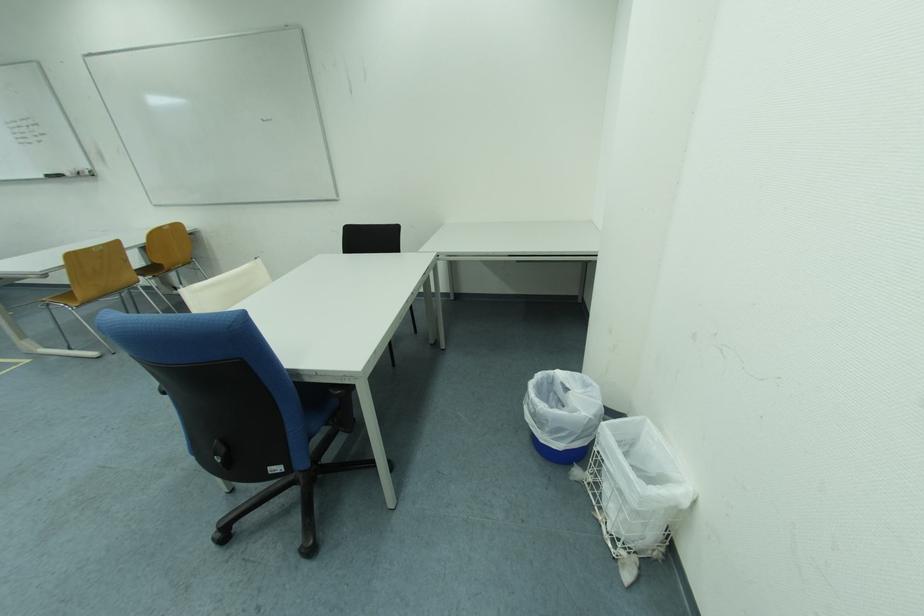
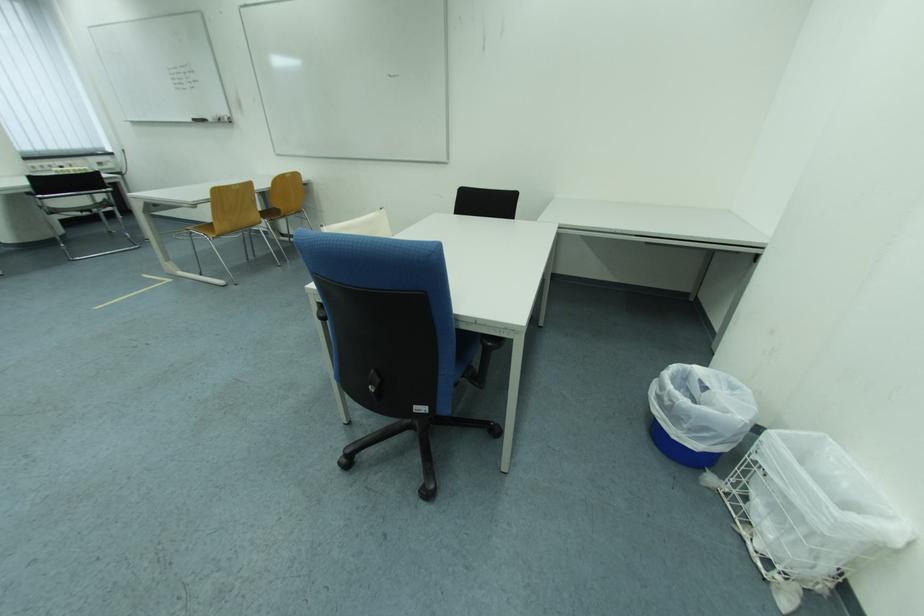
In the second image, find the point that corresponds to (53,302) in the first image.

(197, 231)